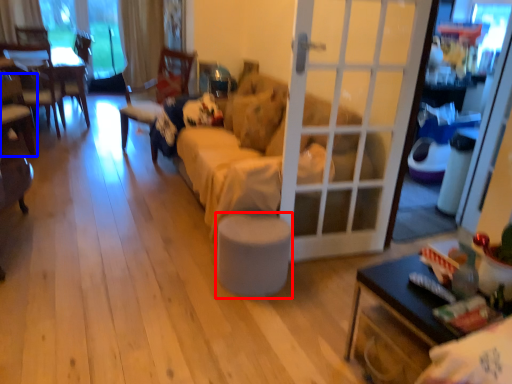
Question: Which of the following is the farthest to the observer, stool (highlighted by a red box) or chair (highlighted by a blue box)?

Choices:
 (A) stool
 (B) chair

Answer: (B)